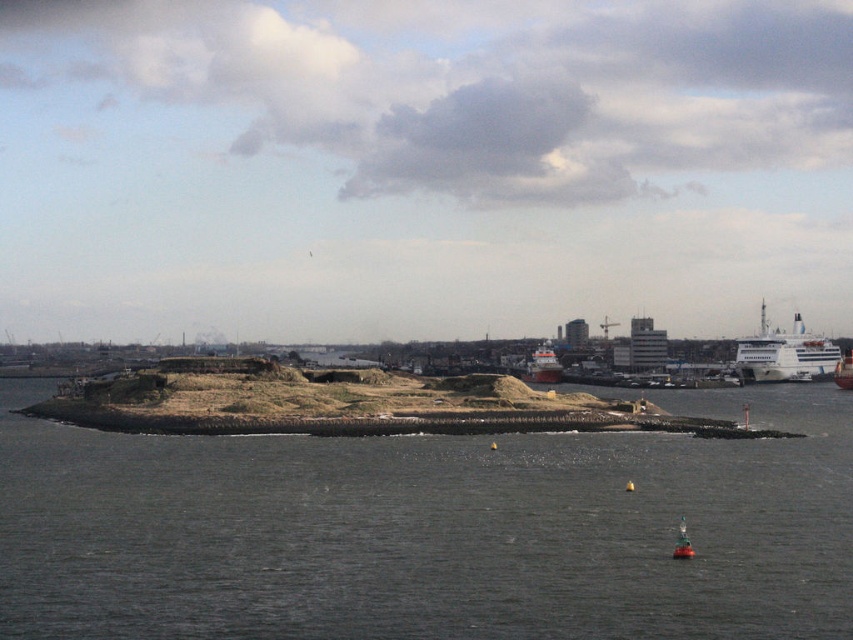
You are standing at the point labeled point (102,440) on the island. You want to walk to the cruise ship docked in the background. Is the cruise ship visible from your current position?

The point labeled point (102,440) is 322.98 feet away from the viewer. Since the cruise ship is docked near the shore in the background, which is beyond the island, the distance might block the view. However, the description mentions the water is calm and reflective, so it is possible the cruise ship could be visible in the reflection. Without specific information about elevation or obstructions, it is uncertain if the cruise ship is directly visible from that point.